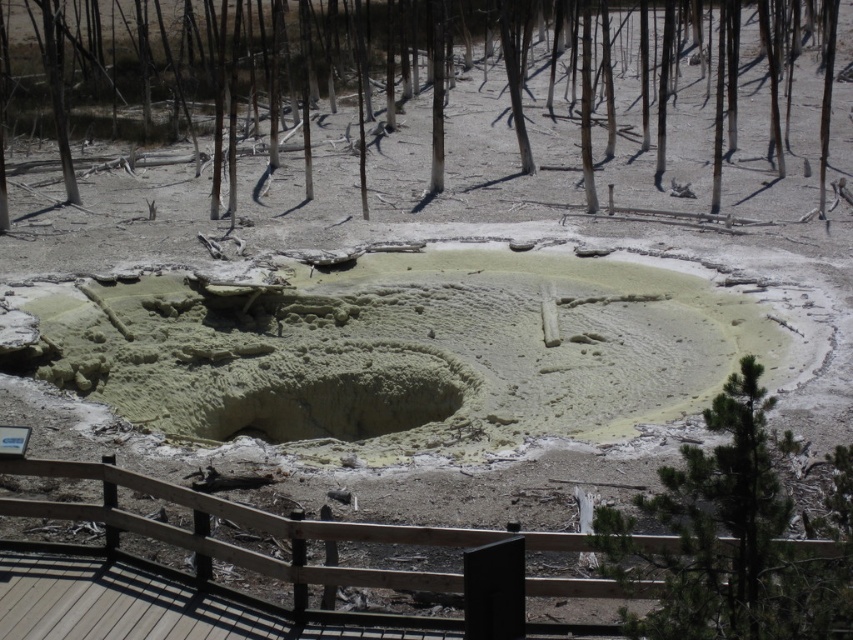
Between gray bark tree at center and green leafy tree at right, which one is positioned higher?

gray bark tree at center is higher up.

Between point (48, 42) and point (675, 630), which one is positioned behind?

Positioned behind is point (48, 42).

Measure the distance between point (x=810, y=1) and camera.

Point (x=810, y=1) and camera are 51.70 meters apart from each other.

Where is `gray bark tree at center`? gray bark tree at center is located at coordinates point(235,64).